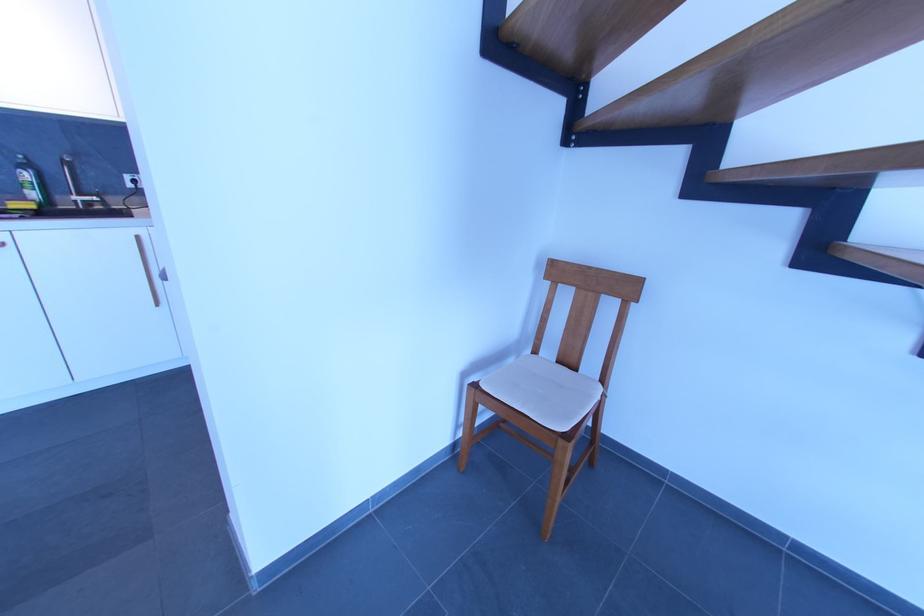
Describe the element at coordinates (84, 200) in the screenshot. This screenshot has width=924, height=616. I see `the faucet handle` at that location.